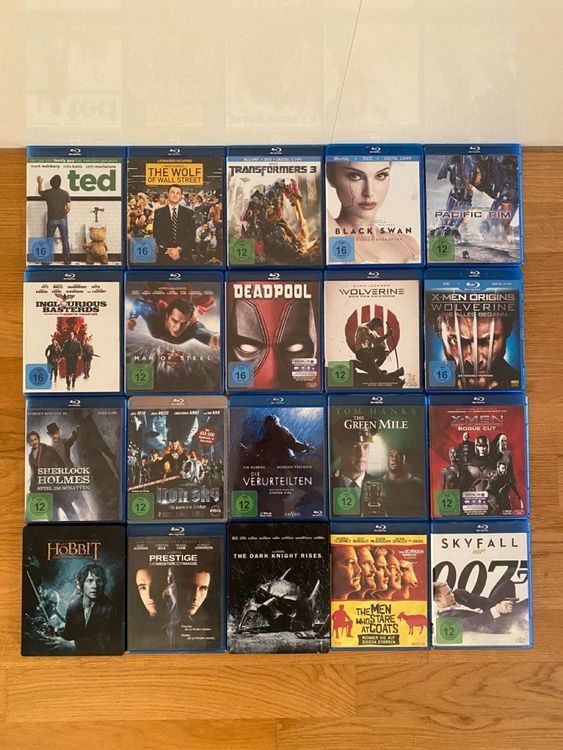
This screenshot has width=563, height=750. What are the coordinates of `left row of dvds` in the screenshot? It's located at click(81, 579), click(77, 445), click(68, 327), click(79, 220).